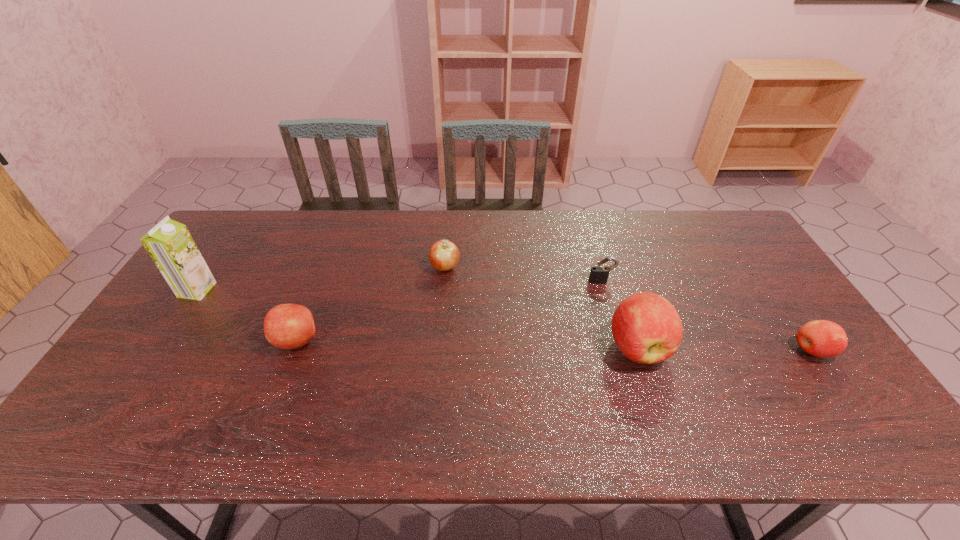
What are the coordinates of `free space located 0.260m on the back of the fourth shortest object` in the screenshot? It's located at (327, 263).

Where is `vacant area located 0.240m on the left of the tallest apple`? vacant area located 0.240m on the left of the tallest apple is located at coordinates tap(516, 347).

You are a GUI agent. You are given a task and a screenshot of the screen. Output one action in this format:
    pyautogui.click(x=<x>, y=<y>)
    Task: Click on the vacant area situated on the left of the rightmost object
    
    Given the screenshot: What is the action you would take?
    pyautogui.click(x=676, y=350)

Find the location of a particular element. Image resolution: width=960 pixels, height=540 pixels. free spot located on the back of the soya milk is located at coordinates (214, 265).

Locate an element on the screen. vacant space located 0.180m on the left of the third object from left to right is located at coordinates (373, 267).

I want to click on vacant space located 0.190m with the keyhole on the front of the padlock, so click(616, 332).

At what (x,y) coordinates should I click in order to perform the action: click on object present at the left edge. Please return your answer as a coordinate pair (x, y). This screenshot has width=960, height=540. Looking at the image, I should click on (170, 245).

Where is `object that is at the right edge`? This screenshot has width=960, height=540. object that is at the right edge is located at coordinates (821, 338).

In the image, there is a desktop. Where is `blank space at the far edge`? The image size is (960, 540). blank space at the far edge is located at coordinates (414, 219).

The width and height of the screenshot is (960, 540). Find the location of `blank space at the near edge of the desktop`. blank space at the near edge of the desktop is located at coordinates (592, 401).